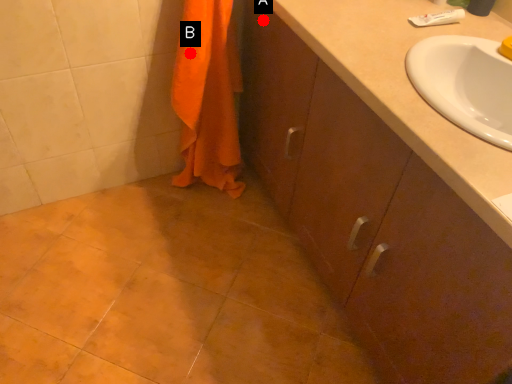
Question: Two points are circled on the image, labeled by A and B beside each circle. Which point is closer to the camera taking this photo?

Choices:
 (A) A is closer
 (B) B is closer

Answer: (B)